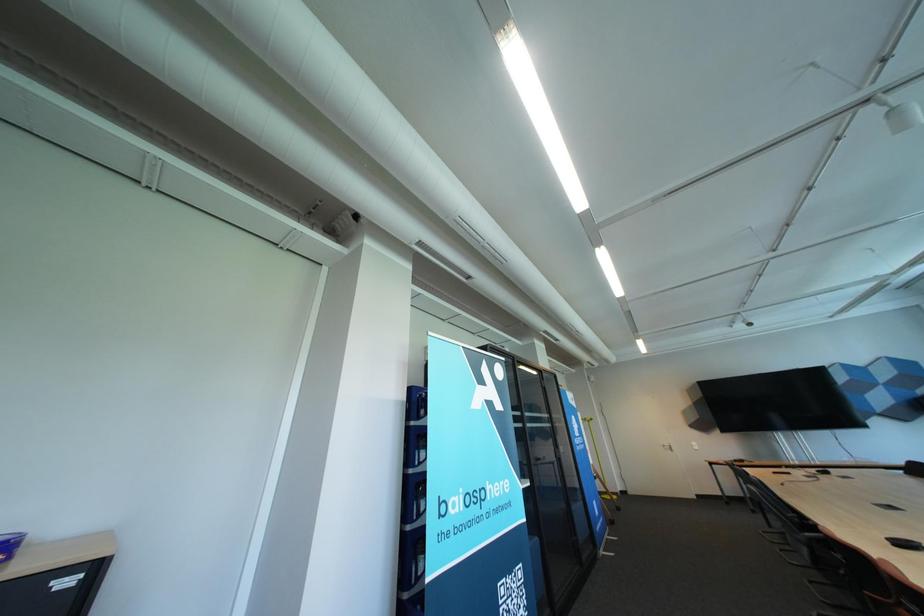
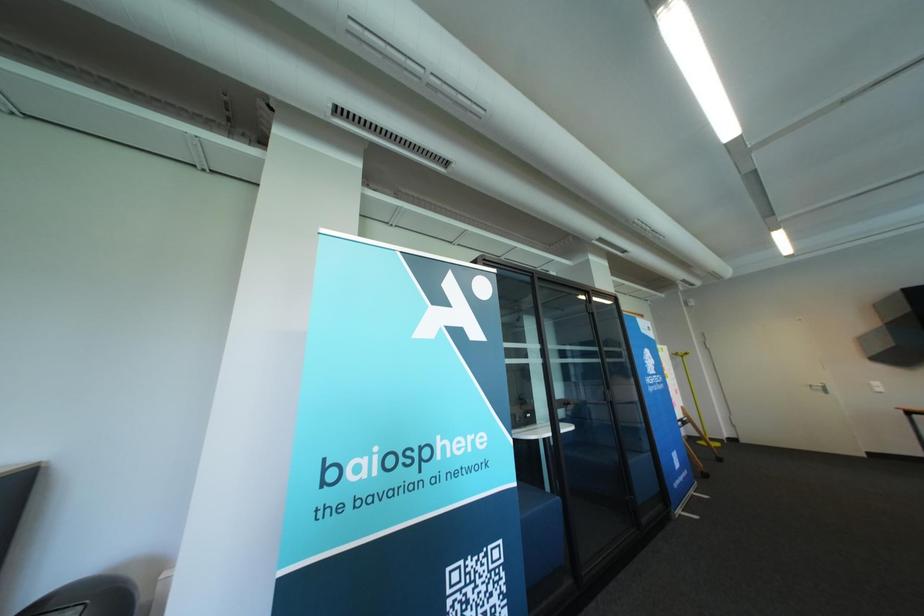
What movement of the cameraman would produce the second image?

The cameraman moved toward right, forward.